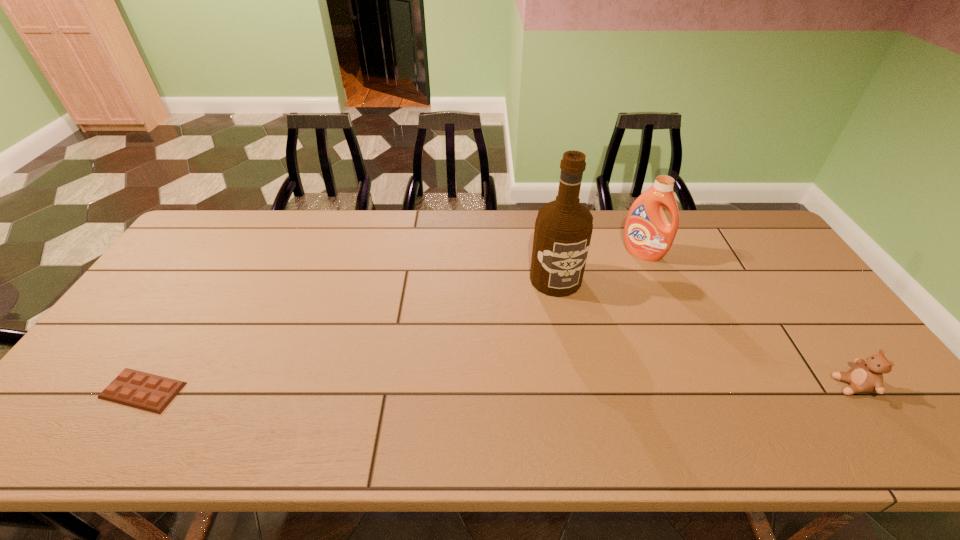
Identify the location of teddy bear present at the near edge. (867, 376).

This screenshot has width=960, height=540. I want to click on object that is at the left edge, so click(145, 391).

Image resolution: width=960 pixels, height=540 pixels. I want to click on object positioned at the right edge, so click(867, 376).

Where is `object located in the near left corner section of the desktop`? This screenshot has height=540, width=960. object located in the near left corner section of the desktop is located at coordinates (145, 391).

Where is `object that is at the near right corner`? The height and width of the screenshot is (540, 960). object that is at the near right corner is located at coordinates (867, 376).

This screenshot has height=540, width=960. What are the coordinates of `free space at the far edge of the desktop` in the screenshot? It's located at (254, 228).

Locate an element on the screen. The height and width of the screenshot is (540, 960). free space at the near edge of the desktop is located at coordinates point(793,377).

The image size is (960, 540). Find the location of `vacant space at the left edge of the desktop`. vacant space at the left edge of the desktop is located at coordinates (128, 356).

You are a GUI agent. You are given a task and a screenshot of the screen. Output one action in this format:
    pyautogui.click(x=<x>, y=<y>)
    Task: Click on the vacant region at the right edge of the desktop
    The height and width of the screenshot is (540, 960).
    Given the screenshot: What is the action you would take?
    pyautogui.click(x=846, y=357)

This screenshot has width=960, height=540. In the image, there is a desktop. In order to click on vacant area at the far right corner in this screenshot , I will do `click(743, 242)`.